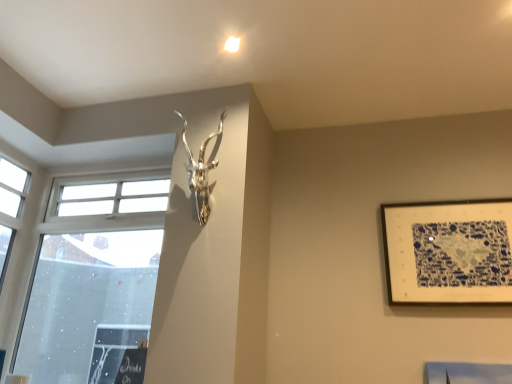
Question: Is blue and white paper at upper right in front of or behind silver metallic antler at upper center in the image?

Choices:
 (A) behind
 (B) front

Answer: (A)

Question: From the image's perspective, is blue and white paper at upper right positioned above or below silver metallic antler at upper center?

Choices:
 (A) below
 (B) above

Answer: (A)

Question: Which of these objects is positioned closest to the blue and white paper at upper right?

Choices:
 (A) transparent glass window at left
 (B) silver metallic antler at upper center

Answer: (B)

Question: Estimate the real-world distances between objects in this image. Which object is farther from the silver metallic antler at upper center?

Choices:
 (A) blue and white paper at upper right
 (B) transparent glass window at left

Answer: (A)